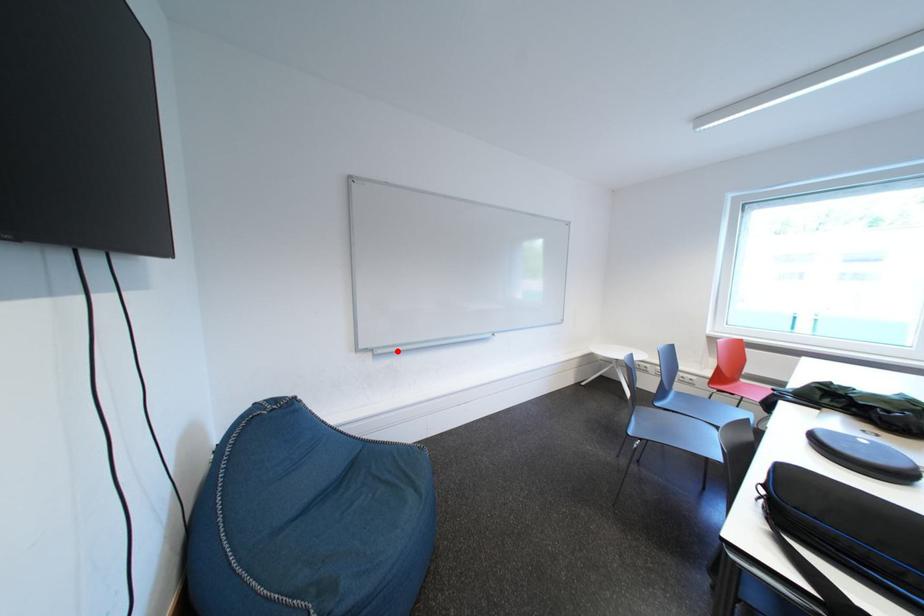
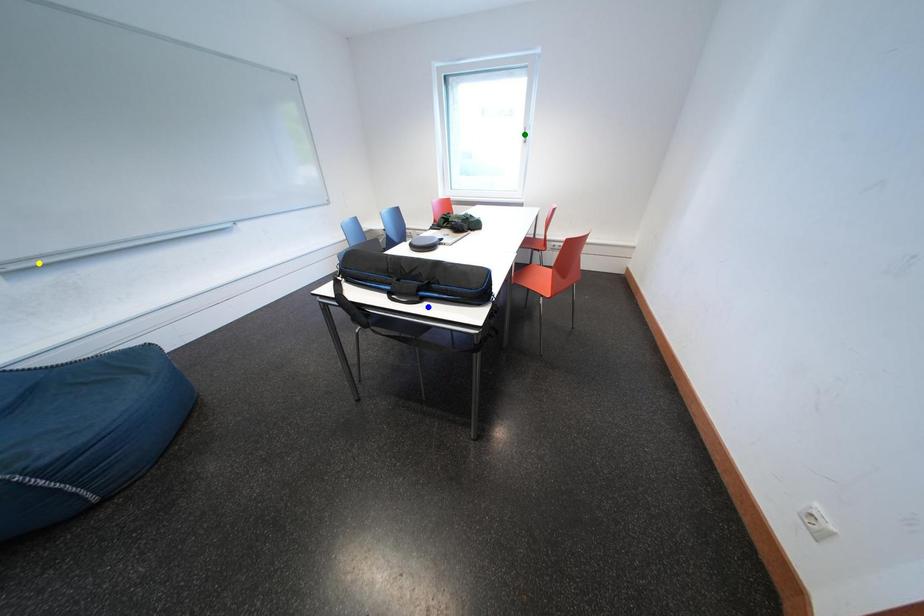
Question: I am providing you with two images of the same scene from different viewpoints. A red point is marked on the first image. You are given multiple points on the second image. In image 2, which mark is for the same physical point as the one in image 1?

Choices:
 (A) yellow point
 (B) blue point
 (C) green point

Answer: (A)